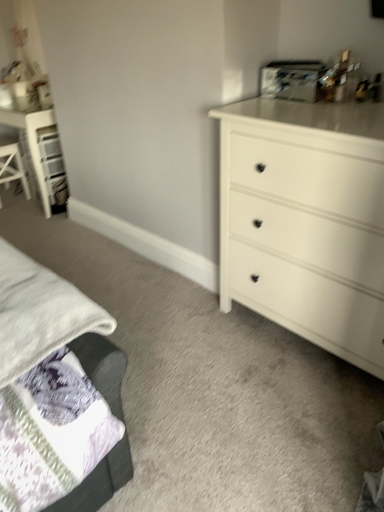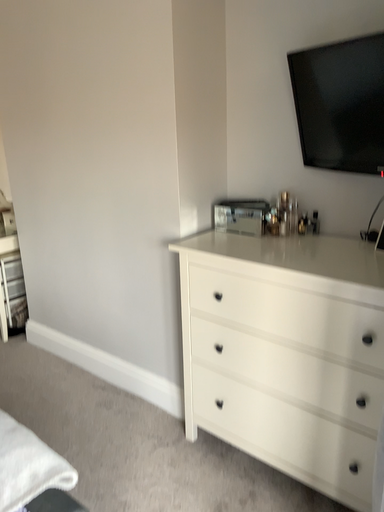
Question: How did the camera likely rotate when shooting the video?

Choices:
 (A) rotated upward
 (B) rotated downward

Answer: (A)